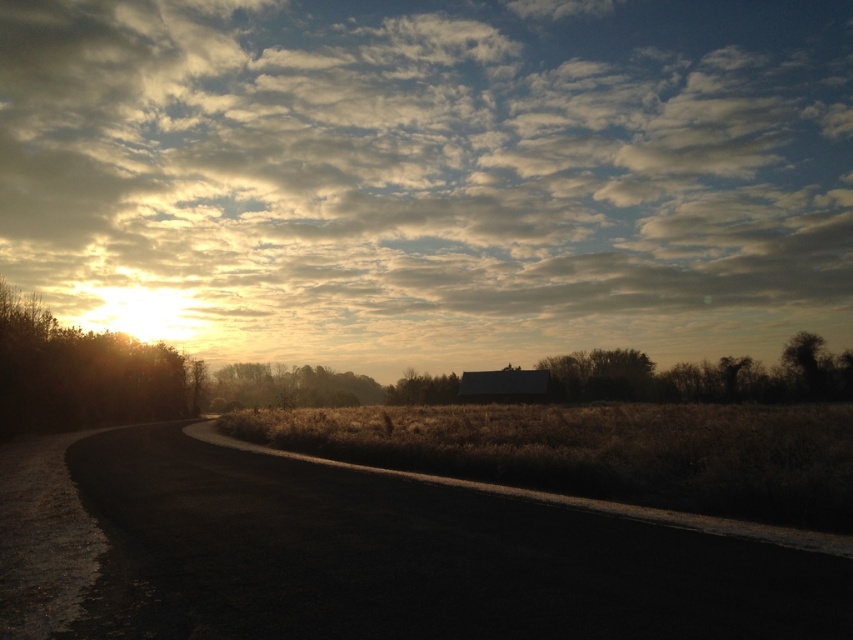
Can you confirm if cloudy sky at upper center is positioned to the left of brown matte tree at center?

Indeed, cloudy sky at upper center is positioned on the left side of brown matte tree at center.

Is point (45, 13) farther from camera compared to point (432, 381)?

Yes, it is.

Find the location of a particular element. The width and height of the screenshot is (853, 640). cloudy sky at upper center is located at coordinates (431, 176).

Which of these two, golden brown foliage at left or brown matte tree at center, stands taller?

With more height is golden brown foliage at left.

Can you confirm if golden brown foliage at left is shorter than brown matte tree at center?

No, golden brown foliage at left is not shorter than brown matte tree at center.

Image resolution: width=853 pixels, height=640 pixels. What are the coordinates of `golden brown foliage at left` in the screenshot? It's located at (80, 374).

Between point (730, 196) and point (634, 500), which one is positioned in front?

Positioned in front is point (634, 500).

Between cloudy sky at upper center and brown grass at center, which one is positioned lower?

brown grass at center

Does point (820, 317) come behind point (479, 440)?

Yes, point (820, 317) is farther from viewer.

The height and width of the screenshot is (640, 853). What are the coordinates of `cloudy sky at upper center` in the screenshot? It's located at (431, 176).